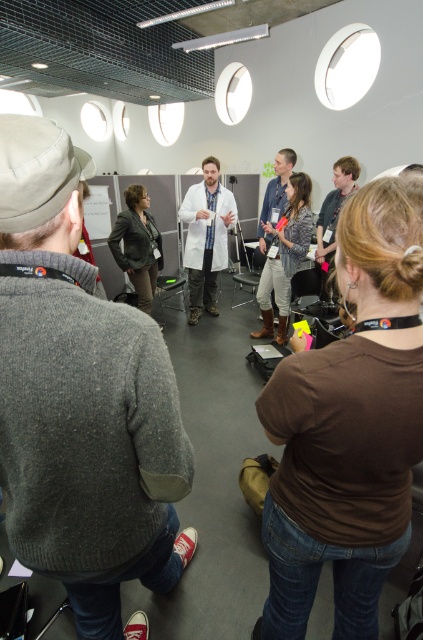
Question: Which point is farther to the camera?

Choices:
 (A) (208, 205)
 (B) (342, 616)

Answer: (A)

Question: Is gray wool sweater at center thinner than dark gray blazer at center?

Choices:
 (A) yes
 (B) no

Answer: (B)

Question: Which object is positioned farthest from the dark gray blazer at center?

Choices:
 (A) white lab coat at center
 (B) brown cotton shirt at center
 (C) gray wool sweater at center
 (D) light brown leather jacket at center

Answer: (B)

Question: Which object is positioned farthest from the gray wool sweater at center?

Choices:
 (A) white lab coat at center
 (B) light brown leather jacket at center
 (C) brown cotton shirt at center
 (D) denim pants at center

Answer: (A)

Question: Where is white lab coat at center located in relation to dark gray blazer at center in the image?

Choices:
 (A) below
 (B) above

Answer: (B)

Question: Is brown cotton shirt at center thinner than denim pants at center?

Choices:
 (A) yes
 (B) no

Answer: (A)